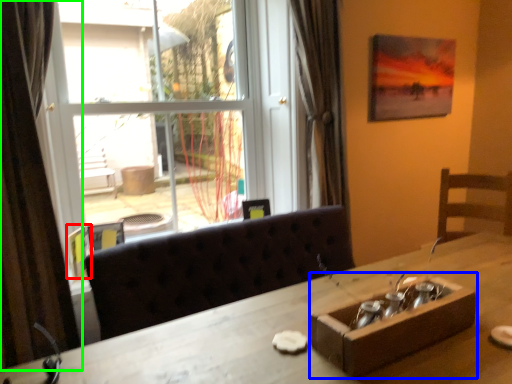
Question: Considering the real-world distances, which object is farthest from picture frame (highlighted by a red box)? cardboard box (highlighted by a blue box) or curtain (highlighted by a green box)?

Choices:
 (A) cardboard box
 (B) curtain

Answer: (A)